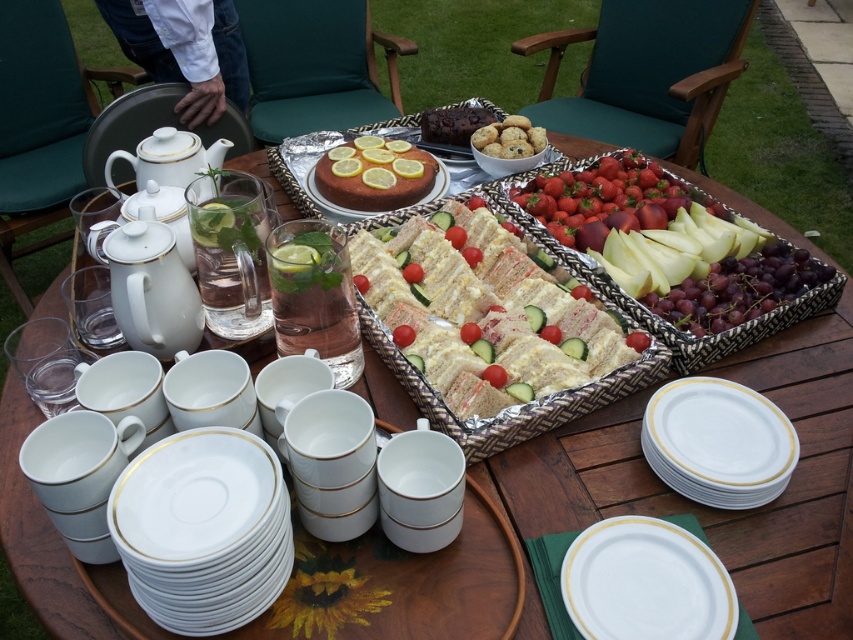
The height and width of the screenshot is (640, 853). I want to click on white porcelain plates at lower left, so click(x=202, y=529).

Describe the element at coordinates (202, 529) in the screenshot. The height and width of the screenshot is (640, 853). I see `white porcelain plates at lower left` at that location.

Where is `white porcelain plates at lower left`? This screenshot has width=853, height=640. white porcelain plates at lower left is located at coordinates (202, 529).

Which of these two, shiny red strawberries at center or chocolate chip cookie dough balls at upper center, stands shorter?

With less height is chocolate chip cookie dough balls at upper center.

Is shiny red strawberries at center thinner than chocolate chip cookie dough balls at upper center?

No, shiny red strawberries at center is not thinner than chocolate chip cookie dough balls at upper center.

Does point (561, 205) come closer to viewer compared to point (543, 144)?

That is True.

Where is `shiny red strawberries at center`? This screenshot has width=853, height=640. shiny red strawberries at center is located at coordinates (602, 196).

Does shiny red strawberries at center have a lesser width compared to matte brown cake at center?

No, shiny red strawberries at center is not thinner than matte brown cake at center.

Can you confirm if shiny red strawberries at center is shorter than matte brown cake at center?

In fact, shiny red strawberries at center may be taller than matte brown cake at center.

Where is `shiny red strawberries at center`? shiny red strawberries at center is located at coordinates (602, 196).

Locate an element on the screen. Image resolution: width=853 pixels, height=640 pixels. shiny red strawberries at center is located at coordinates (602, 196).